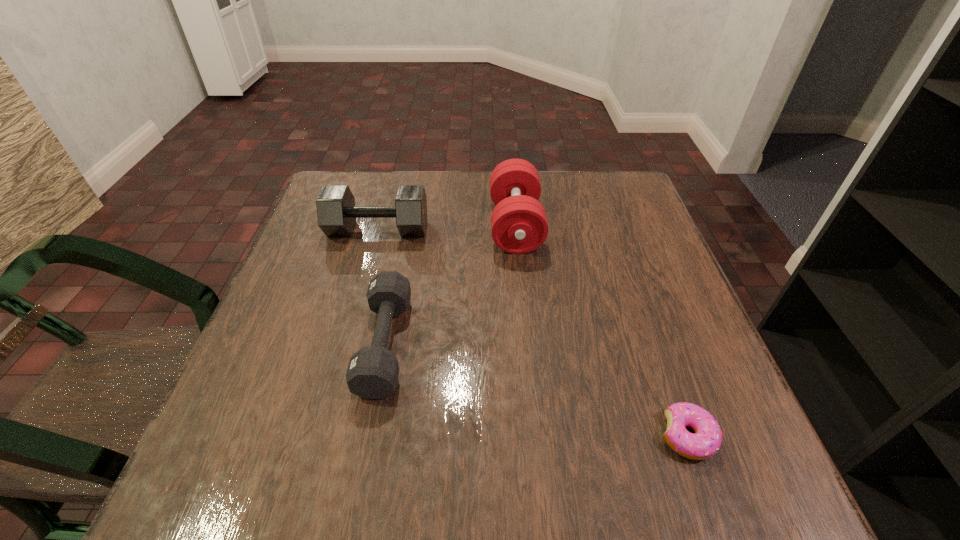
Locate an element on the screen. Image resolution: width=960 pixels, height=540 pixels. dumbbell that is the closest to the shortest object is located at coordinates (519, 225).

Locate an element on the screen. vacant space that satisfies the following two spatial constraints: 1. on the back side of the third object from left to right; 2. on the left side of the shortest dumbbell is located at coordinates (408, 226).

Locate an element on the screen. This screenshot has width=960, height=540. free region that satisfies the following two spatial constraints: 1. on the front side of the second tallest object; 2. on the right side of the nearest dumbbell is located at coordinates (348, 344).

Find the location of `vacant space that satisfies the following two spatial constraints: 1. on the front side of the shortest object; 2. on the right side of the rightmost dumbbell`. vacant space that satisfies the following two spatial constraints: 1. on the front side of the shortest object; 2. on the right side of the rightmost dumbbell is located at coordinates (536, 436).

The width and height of the screenshot is (960, 540). In order to click on free space that satisfies the following two spatial constraints: 1. on the front side of the second shortest dumbbell; 2. on the right side of the nearest dumbbell in this screenshot , I will do [x=348, y=344].

This screenshot has width=960, height=540. In order to click on free space that satisfies the following two spatial constraints: 1. on the back side of the nearest dumbbell; 2. on the left side of the rightmost dumbbell in this screenshot , I will do `click(408, 226)`.